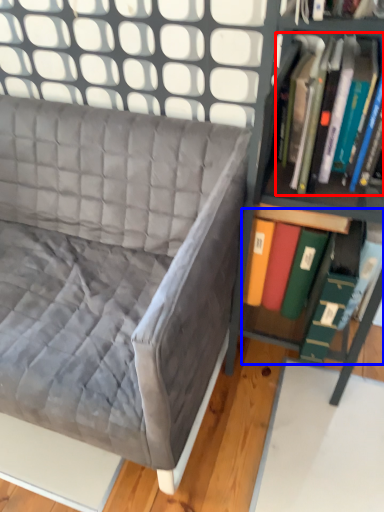
Question: Which of the following is the closest to the observer, book (highlighted by a red box) or book (highlighted by a blue box)?

Choices:
 (A) book
 (B) book

Answer: (A)